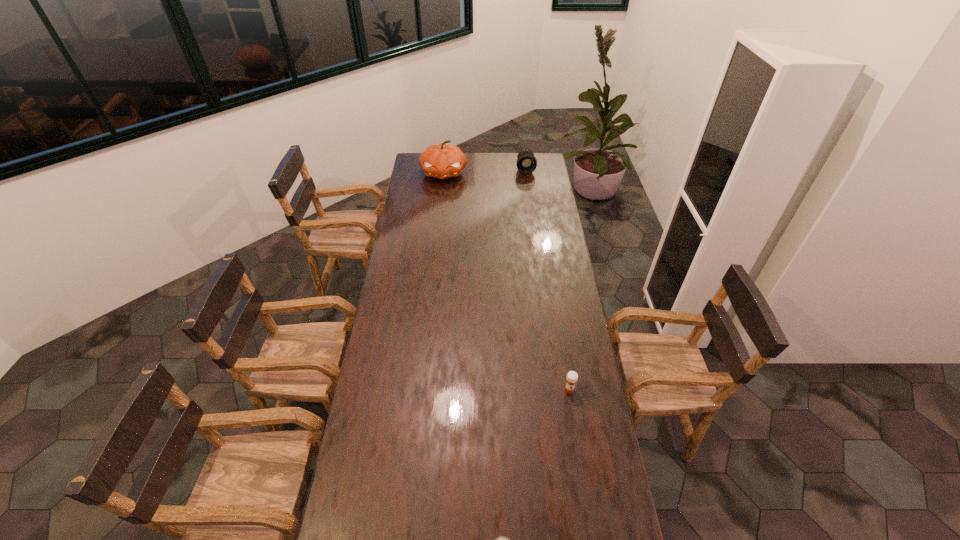
The height and width of the screenshot is (540, 960). Identify the location of vacant space in between the leftmost object and the farther medicine. (506, 281).

You are a GUI agent. You are given a task and a screenshot of the screen. Output one action in this format:
    pyautogui.click(x=<x>, y=<y>)
    Task: Click on the free space between the pumpkin and the telephoto lens
    Image resolution: width=960 pixels, height=540 pixels.
    Given the screenshot: What is the action you would take?
    pyautogui.click(x=485, y=171)

Locate an element on the screen. The image size is (960, 540). the third closest object to the leftmost object is located at coordinates (502, 539).

At what (x,y) coordinates should I click in order to perform the action: click on object that stands as the second closest to the leftmost object. Please return your answer as a coordinate pair (x, y). This screenshot has height=540, width=960. Looking at the image, I should click on (572, 377).

Identify which medicine is the second closest to the pumpkin. Please provide its 2D coordinates. Your answer should be formatted as a tuple, i.e. [(x, y)], where the tuple contains the x and y coordinates of a point satisfying the conditions above.

[(502, 539)]